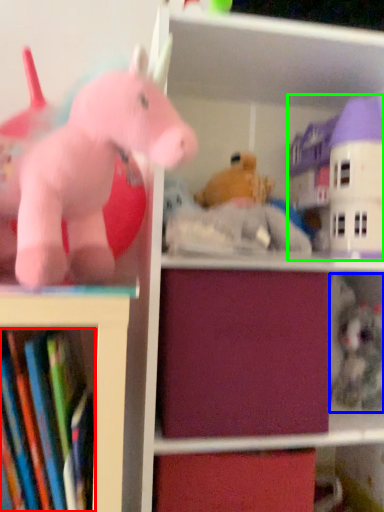
Question: Which object is positioned closest to book (highlighted by a red box)? Select from toy (highlighted by a blue box) and toy (highlighted by a green box).

Choices:
 (A) toy
 (B) toy

Answer: (A)